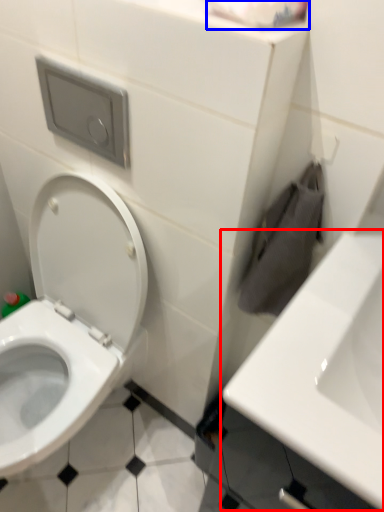
Question: Which point is further to the camera, sink (highlighted by a red box) or toilet paper (highlighted by a blue box)?

Choices:
 (A) sink
 (B) toilet paper

Answer: (B)